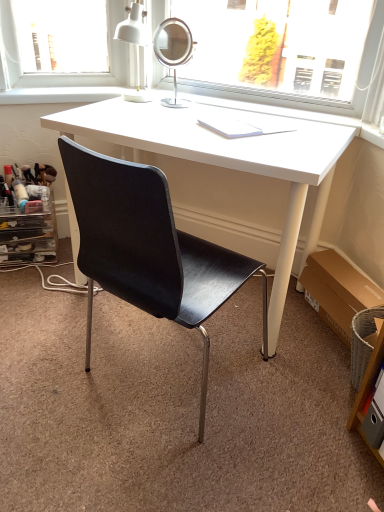
Where is `vacant area that lies between white glossy desk at center and black leather chair at center`? The image size is (384, 512). vacant area that lies between white glossy desk at center and black leather chair at center is located at coordinates (108, 340).